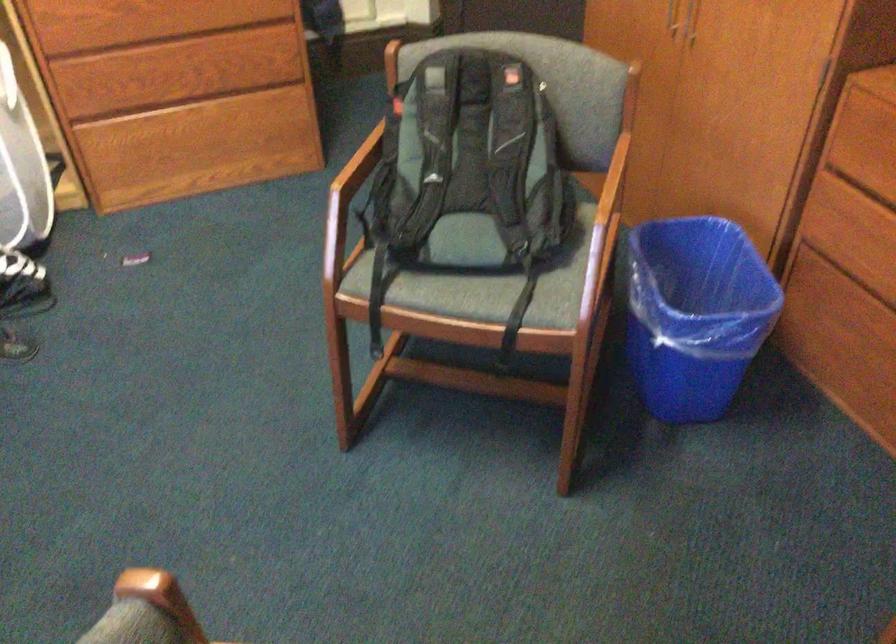
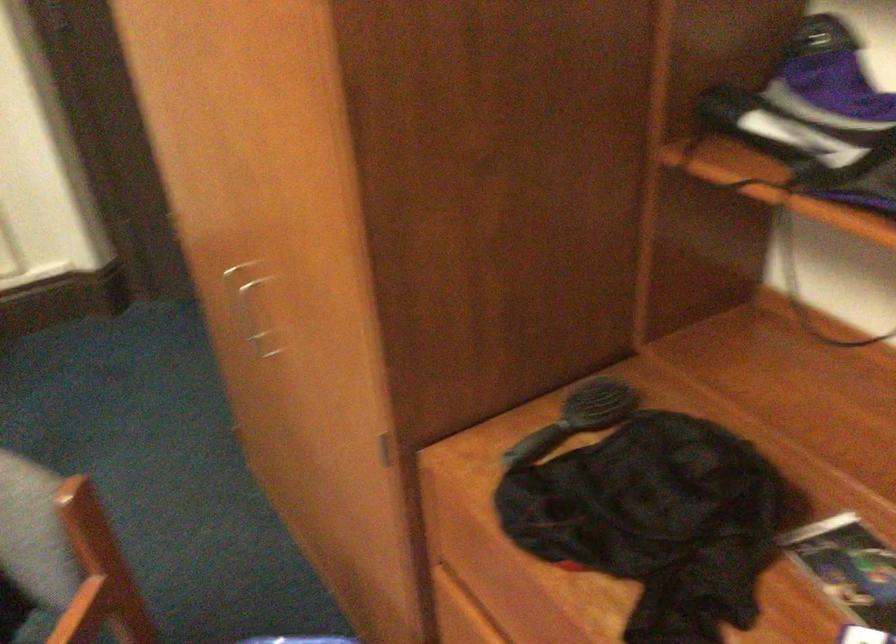
The images are taken continuously from a first-person perspective. In which direction are you moving?

The cameraman moved toward right, forward.